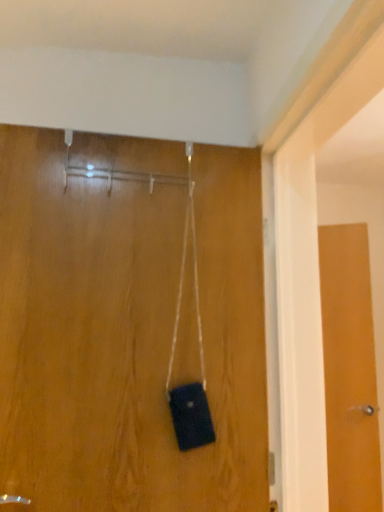
Question: Which direction should I rotate to look at matte wood door at center, positioned as the first door in left-to-right order, — up or down?

Choices:
 (A) up
 (B) down

Answer: (B)

Question: Does matte wood door at center, which is the second door in right-to-left order, have a greater height compared to wooden door at right, the 1th door positioned from the right?

Choices:
 (A) yes
 (B) no

Answer: (B)

Question: From the image's perspective, does matte wood door at center, acting as the second door starting from the back, appear lower than wooden door at right, the 1th door positioned from the right?

Choices:
 (A) no
 (B) yes

Answer: (A)

Question: Considering the relative sizes of matte wood door at center, positioned as the first door in left-to-right order, and wooden door at right, which appears as the first door when viewed from the back, in the image provided, is matte wood door at center, positioned as the first door in left-to-right order, smaller than wooden door at right, which appears as the first door when viewed from the back,?

Choices:
 (A) no
 (B) yes

Answer: (A)

Question: Can you confirm if matte wood door at center, which is the second door in right-to-left order, is positioned to the left of wooden door at right, the 2th door from the left?

Choices:
 (A) no
 (B) yes

Answer: (B)

Question: Is matte wood door at center, acting as the second door starting from the back, with wooden door at right, the 2th door from the front?

Choices:
 (A) yes
 (B) no

Answer: (B)

Question: Is matte wood door at center, which is the first door from front to back, oriented away from wooden door at right, the 2th door from the front?

Choices:
 (A) yes
 (B) no

Answer: (B)

Question: From a real-world perspective, is wooden door at right, the 2th door from the front, beneath matte wood door at center, which is the first door from front to back?

Choices:
 (A) yes
 (B) no

Answer: (A)

Question: Is wooden door at right, which appears as the first door when viewed from the back, to the right of matte wood door at center, which is the second door in right-to-left order, from the viewer's perspective?

Choices:
 (A) no
 (B) yes

Answer: (B)

Question: From a real-world perspective, is wooden door at right, the 2th door from the left, positioned over matte wood door at center, which is the second door in right-to-left order, based on gravity?

Choices:
 (A) yes
 (B) no

Answer: (B)

Question: From the image's perspective, would you say wooden door at right, the 2th door from the front, is shown under matte wood door at center, positioned as the first door in left-to-right order?

Choices:
 (A) no
 (B) yes

Answer: (B)

Question: Considering the relative positions of wooden door at right, the 1th door positioned from the right, and matte wood door at center, which is the second door in right-to-left order, in the image provided, is wooden door at right, the 1th door positioned from the right, in front of matte wood door at center, which is the second door in right-to-left order,?

Choices:
 (A) yes
 (B) no

Answer: (B)

Question: Does wooden door at right, the 2th door from the left, have a lesser height compared to matte wood door at center, which is the second door in right-to-left order?

Choices:
 (A) yes
 (B) no

Answer: (B)

Question: From the image's perspective, is matte wood door at center, which is the second door in right-to-left order, above or below wooden door at right, which appears as the first door when viewed from the back?

Choices:
 (A) below
 (B) above

Answer: (B)